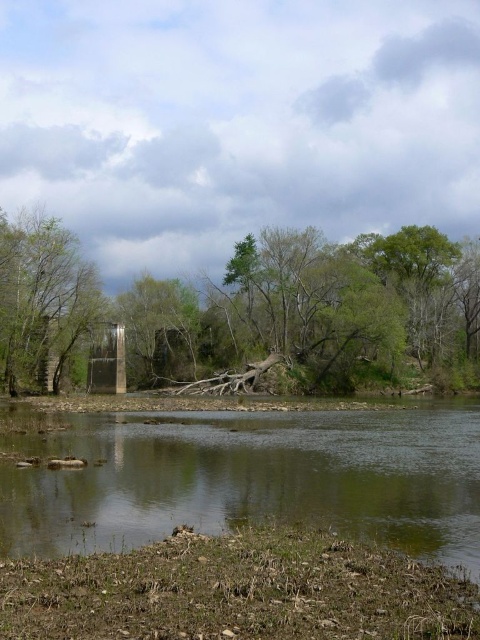
You are standing at the riverbank and see the brown rough tree at center and the green matte tree at left. Which tree is closer to you?

The brown rough tree at center is closer to you because the green matte tree at left is behind it.

Based on the photo, you are standing at the riverbank and see the brown rough tree at center and the green matte tree at left. Which tree is closer to your right side?

The brown rough tree at center is closer to your right side because it is positioned to the right of the green matte tree at left.